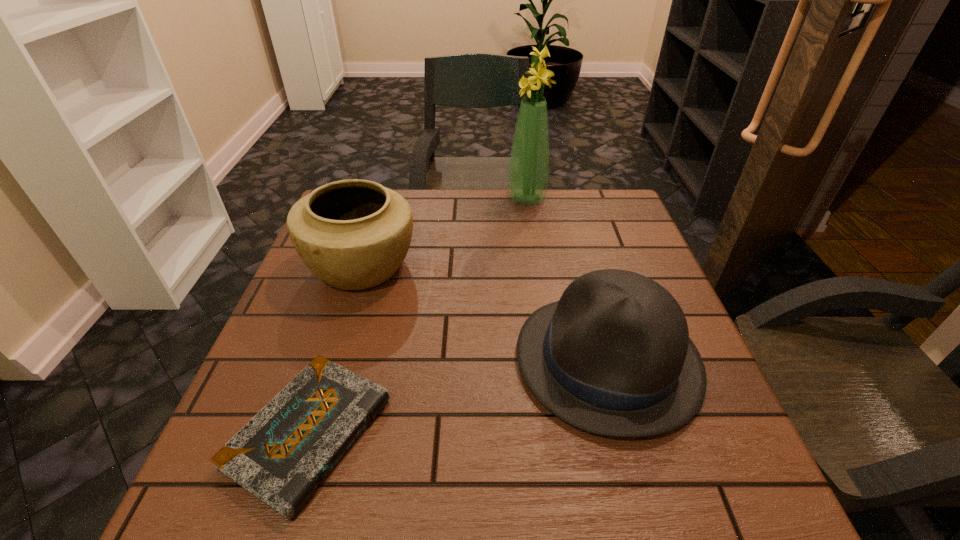
Identify the location of the farthest object. (528, 172).

Identify the location of bouquet. The width and height of the screenshot is (960, 540). (528, 172).

This screenshot has width=960, height=540. In order to click on pottery in this screenshot , I will do `click(354, 234)`.

You are a GUI agent. You are given a task and a screenshot of the screen. Output one action in this format:
    pyautogui.click(x=<x>, y=<y>)
    Task: Click on the bowler hat
    The image size is (960, 540).
    Given the screenshot: What is the action you would take?
    pyautogui.click(x=613, y=357)

What are the coordinates of `notebook` in the screenshot? It's located at (283, 453).

This screenshot has height=540, width=960. What are the coordinates of `free point located 0.240m on the front-facing side of the tallest object` in the screenshot? It's located at (426, 198).

The image size is (960, 540). Find the location of `free region located on the front-facing side of the tallest object`. free region located on the front-facing side of the tallest object is located at coordinates (484, 198).

At what (x,y) coordinates should I click in order to perform the action: click on free region located 0.270m on the front-facing side of the tallest object. Please return your answer as a coordinate pair (x, y). The image size is (960, 540). Looking at the image, I should click on (417, 198).

At what (x,y) coordinates should I click in order to perform the action: click on free region located 0.180m on the back of the pottery. Please return your answer as a coordinate pair (x, y). The height and width of the screenshot is (540, 960). Looking at the image, I should click on pyautogui.click(x=383, y=199).

Locate an element on the screen. The width and height of the screenshot is (960, 540). vacant space located on the front-facing side of the bowler hat is located at coordinates (429, 359).